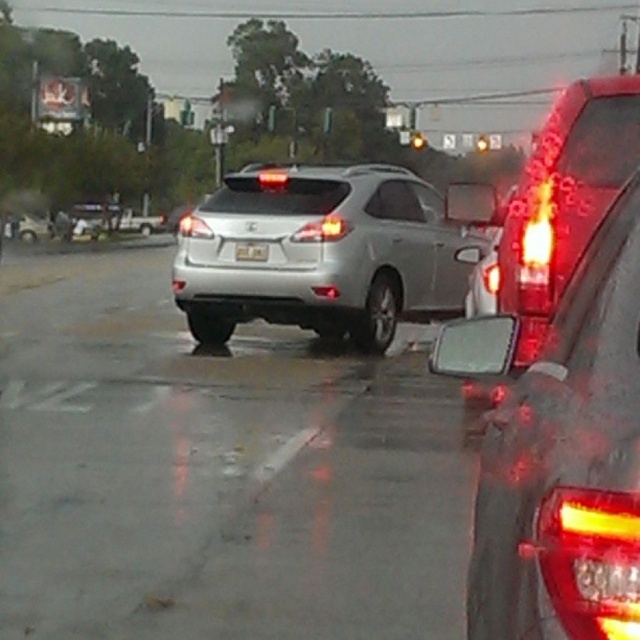
Who is more forward, [528,529] or [477,150]?

Positioned in front is point [528,529].

Can you confirm if matte black suv at center is shorter than transparent glass traffic light at upper center?

Correct, matte black suv at center is not as tall as transparent glass traffic light at upper center.

I want to click on matte black suv at center, so click(x=561, y=452).

Between glassy red traffic light at upper center and transparent glass traffic light at upper center, which one appears on the right side from the viewer's perspective?

Positioned to the right is transparent glass traffic light at upper center.

Who is more distant from viewer, (x=413, y=131) or (x=486, y=136)?

Point (x=413, y=131)

You are a GUI agent. You are given a task and a screenshot of the screen. Output one action in this format:
    pyautogui.click(x=<x>, y=<y>)
    Task: Click on the glassy red traffic light at upper center
    
    Given the screenshot: What is the action you would take?
    pyautogui.click(x=417, y=140)

Does satin silver suv at center come behind glassy red traffic light at upper center?

No, it is not.

Is satin silver suv at center closer to the viewer compared to glassy red traffic light at upper center?

Yes, it is in front of glassy red traffic light at upper center.

Where is `satin silver suv at center`? satin silver suv at center is located at coordinates (320, 252).

At what (x,y) coordinates should I click in order to perform the action: click on satin silver suv at center. Please return your answer as a coordinate pair (x, y). This screenshot has width=640, height=640. Looking at the image, I should click on (320, 252).